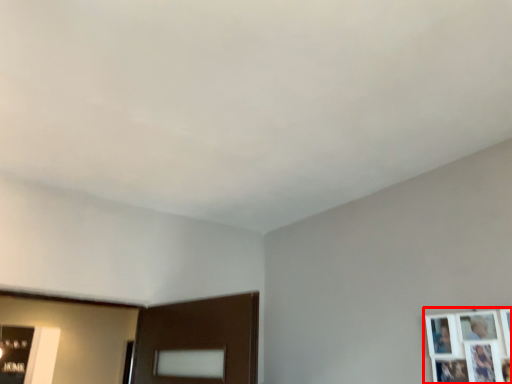
Question: From the image's perspective, where is picture frame (annotated by the red box) located relative to picture frame?

Choices:
 (A) above
 (B) below

Answer: (A)